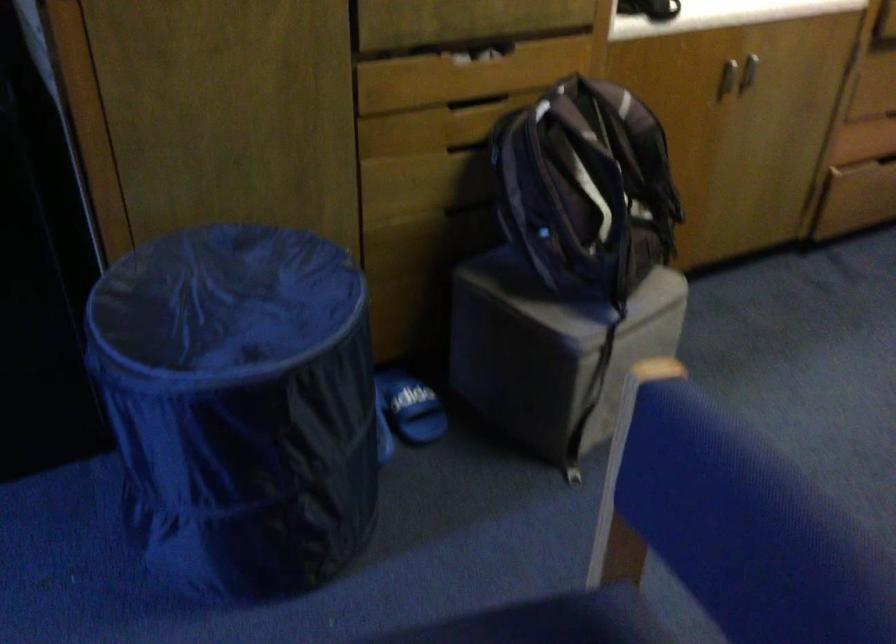
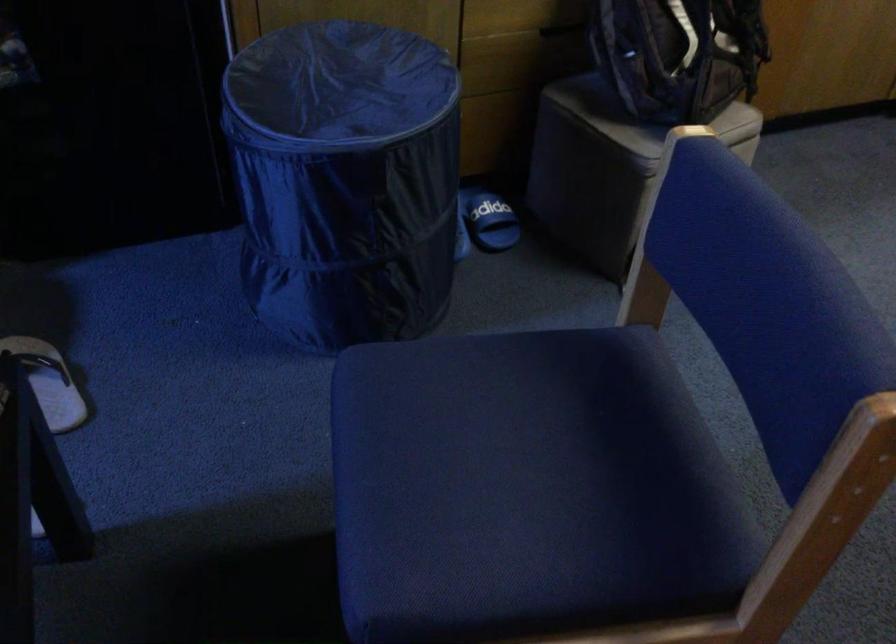
Question: The first image is from the beginning of the video and the second image is from the end. How did the camera likely rotate when shooting the video?

Choices:
 (A) Left
 (B) Right
 (C) Up
 (D) Down

Answer: (D)